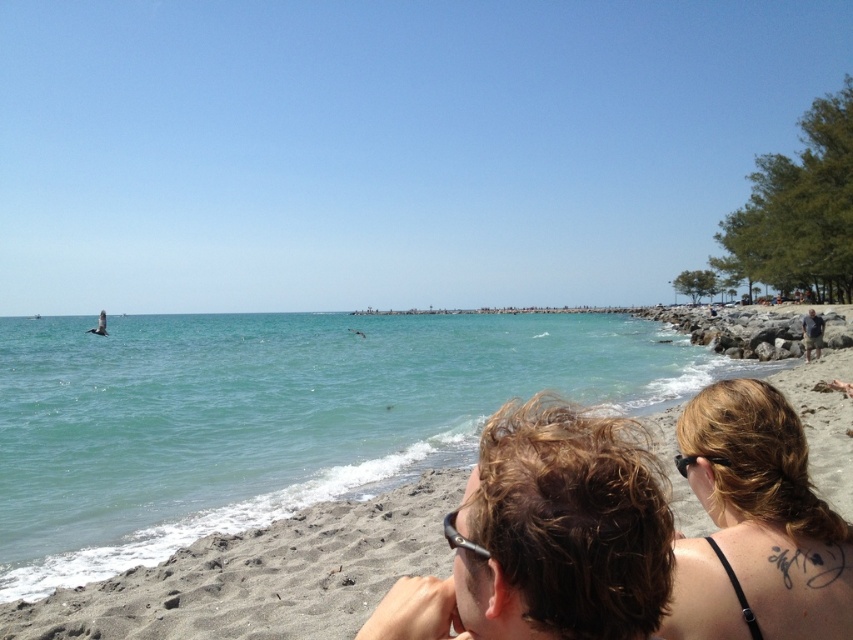
Looking at this image, you are a photographer trying to capture a photo of both the brown hair at center and the dark blonde hair at upper right. Which one would appear larger in the photo?

The brown hair at center would appear larger in the photo because it is closer to the viewer than the dark blonde hair at upper right.

You are standing on the beach and want to take a photo of the clear blue water at center. Where should you point your camera to capture it?

You should point your camera towards the center of the image at point coordinates approximately 0.653 on the x axis and 0.318 on the y axis to capture the clear blue water at center.

You are a photographer wanting to capture a shot of the clear blue water at center and the dark blonde hair at upper right. Which object is positioned closer to the camera?

The clear blue water at center is closer to the camera because the dark blonde hair at upper right is behind it.